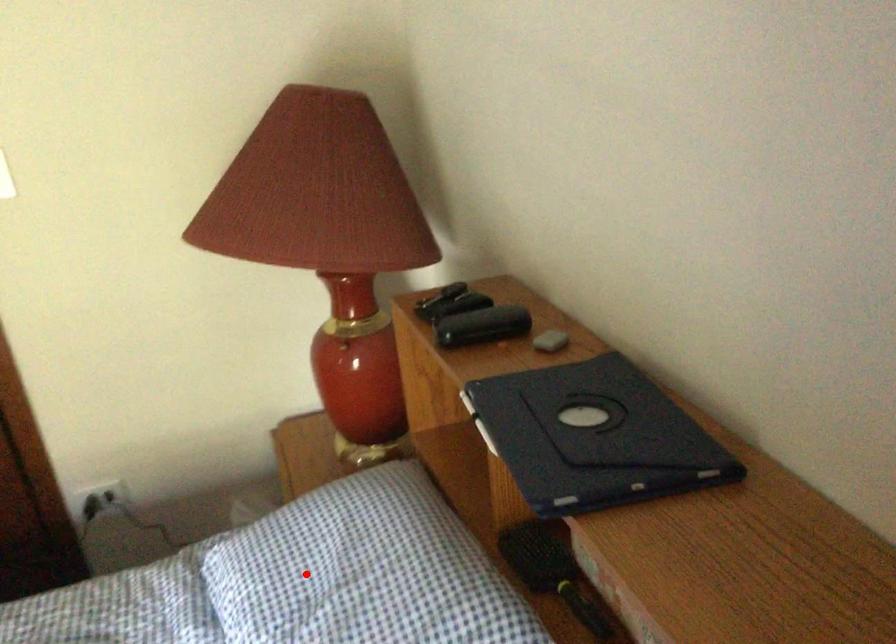
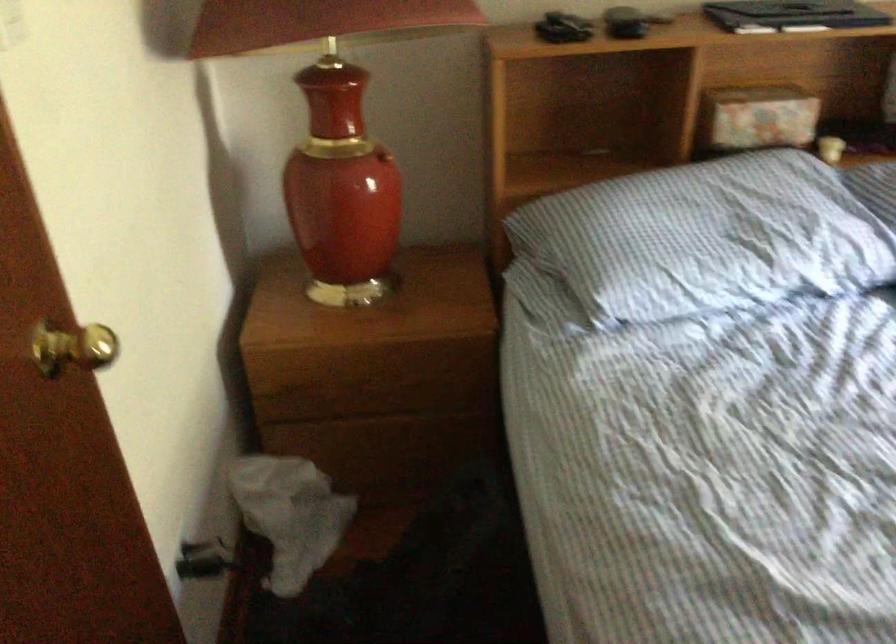
Question: I am providing you with two images of the same scene from different viewpoints. Image1 has a red point marked. In image2, the corresponding 3D location appears at what relative position? Reply with the corresponding letter.

Choices:
 (A) Closer
 (B) Farther

Answer: (B)